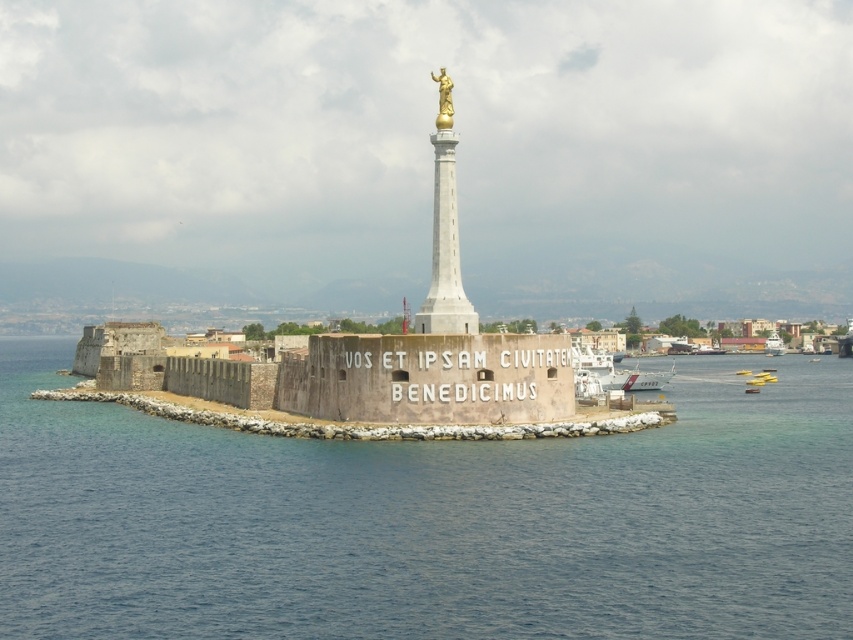
You are a tourist standing on the monument island and want to reach the mainland across the blue water at center. You see a white plastic boat at lower right nearby. Can you determine if the boat can carry you across the water?

The blue water at center might be wider than white plastic boat at lower right, so the boat might not be able to carry you across the water.

You are standing at the point marked as point (167, 596) and want to take a photo of the monument. The camera you are using has a maximum zoom range of 100 meters. Can you capture the monument in your photo without moving closer?

The distance between you and the monument is 40.66 meters, which is within the camera maximum zoom range of 100 meters. Therefore, you can capture the monument in your photo without moving closer.